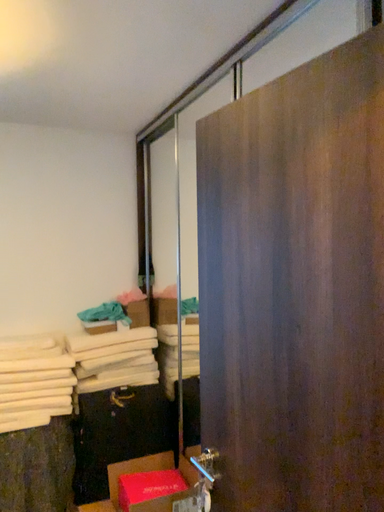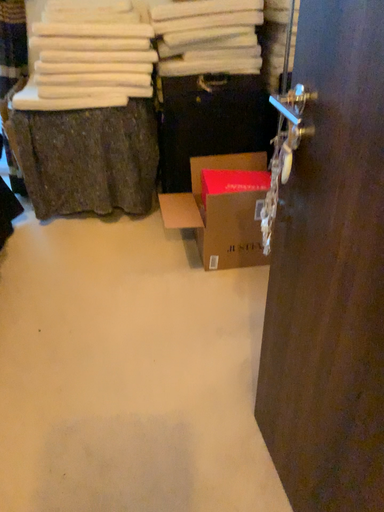
Question: How did the camera likely rotate when shooting the video?

Choices:
 (A) rotated downward
 (B) rotated upward

Answer: (A)